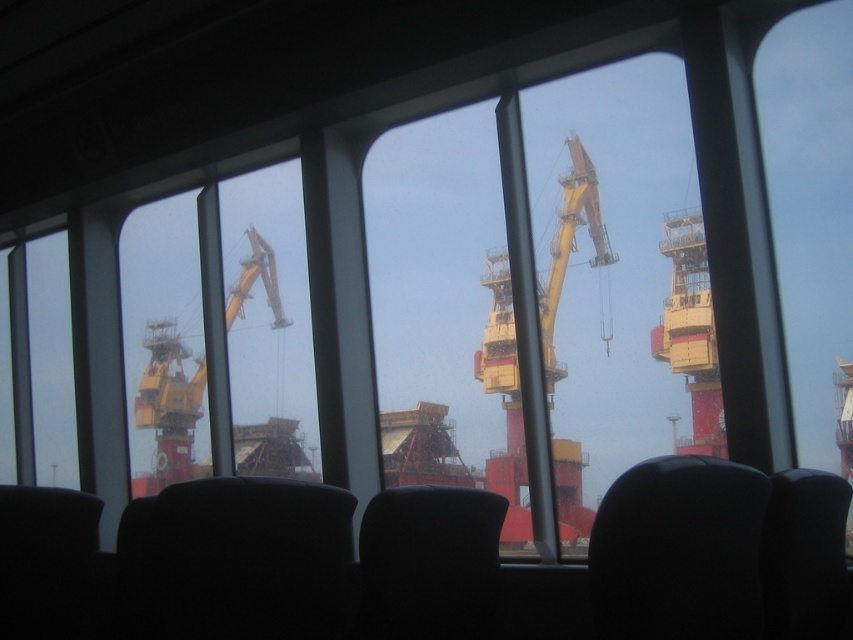
Who is more forward, (698, 465) or (271, 486)?

Point (698, 465) is more forward.

This screenshot has width=853, height=640. What do you see at coordinates (718, 552) in the screenshot? I see `black leather chair at lower right` at bounding box center [718, 552].

Who is more distant from viewer, (807,596) or (285,552)?

The point (807,596) is more distant.

Find the location of `black leather chair at lower right`. black leather chair at lower right is located at coordinates (718, 552).

The height and width of the screenshot is (640, 853). What do you see at coordinates (428, 563) in the screenshot? I see `black fabric chair at center` at bounding box center [428, 563].

Is black fabric chair at center taller than yellow metallic crane at center?

Incorrect, black fabric chair at center's height is not larger of yellow metallic crane at center's.

Between point (381, 509) and point (505, 280), which one is positioned behind?

Point (505, 280)

I want to click on black fabric chair at center, so click(x=428, y=563).

Is point (445, 545) farther from camera compared to point (24, 534)?

No, (445, 545) is closer to viewer.

In order to click on black fabric chair at center in this screenshot , I will do `click(428, 563)`.

Is point (425, 636) positioned in front of point (71, 604)?

Yes, it is in front of point (71, 604).

This screenshot has height=640, width=853. I want to click on black fabric chair at center, so click(x=428, y=563).